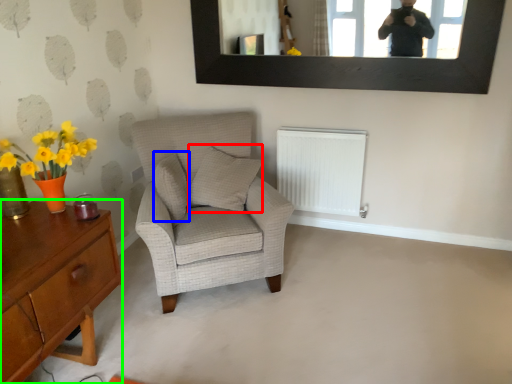
Question: Which object is positioned farthest from pillow (highlighted by a red box)? Select from pillow (highlighted by a blue box) and desk (highlighted by a green box).

Choices:
 (A) pillow
 (B) desk

Answer: (B)